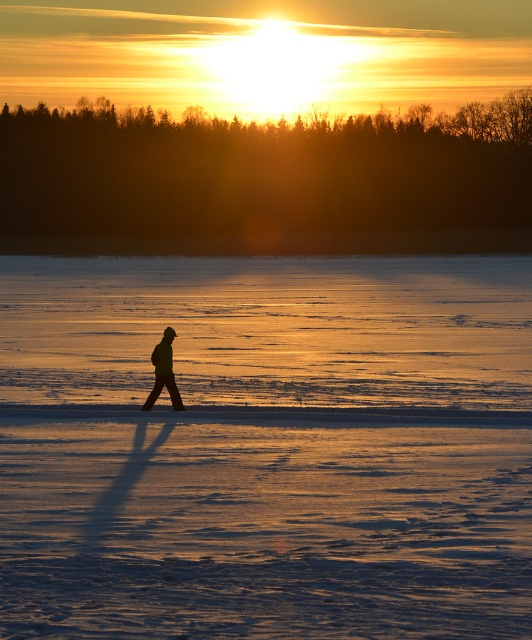
Based on the photo, you are standing at the edge of the frozen lake and see the point marked as point (267, 448). Is the ice at that point safe to walk on?

The point (267, 448) indicates smooth ice at center, so yes, the ice at that point is safe to walk on.